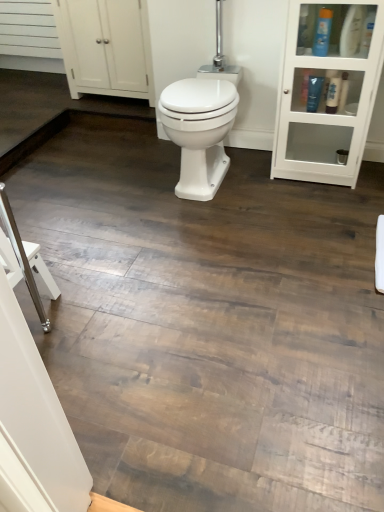
Where is `free space to the left of white glass cabinet at upper right`? Image resolution: width=384 pixels, height=512 pixels. free space to the left of white glass cabinet at upper right is located at coordinates (255, 180).